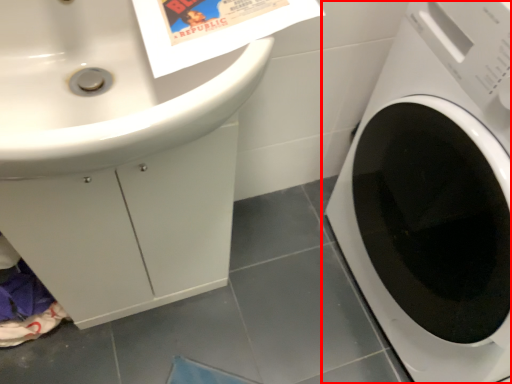
Question: Where is washing machine (annotated by the red box) located in relation to sink in the image?

Choices:
 (A) right
 (B) left

Answer: (A)